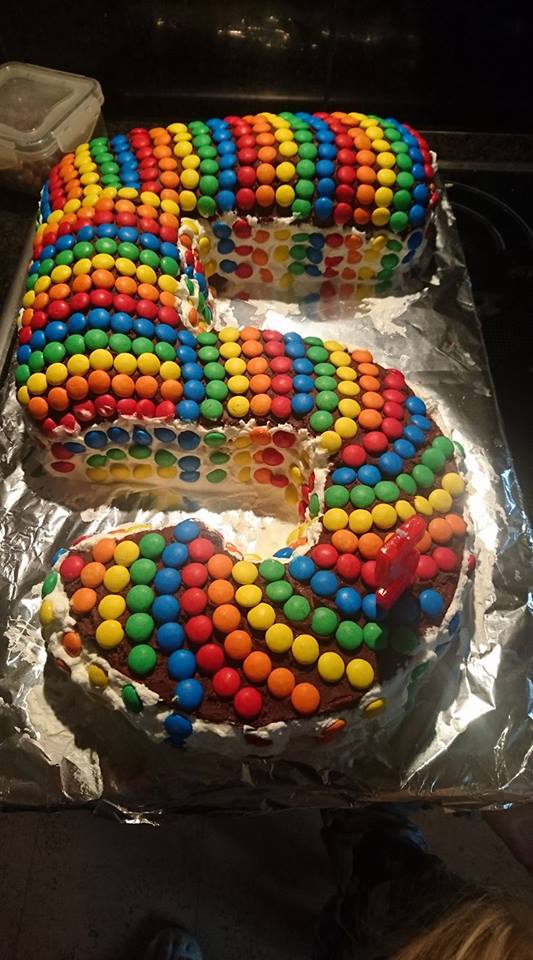
The height and width of the screenshot is (960, 533). Find the location of `red number 5 candle`. red number 5 candle is located at coordinates (407, 566).